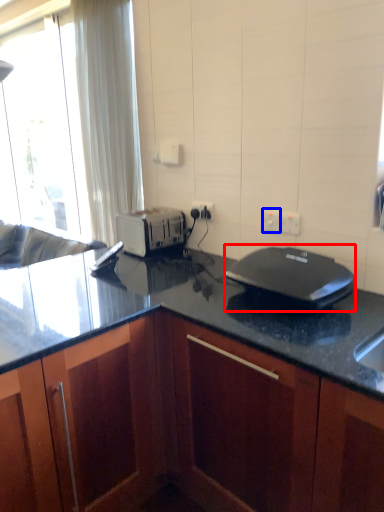
Question: Which of the following is the closest to the observer, home appliance (highlighted by a red box) or electric outlet (highlighted by a blue box)?

Choices:
 (A) home appliance
 (B) electric outlet

Answer: (A)